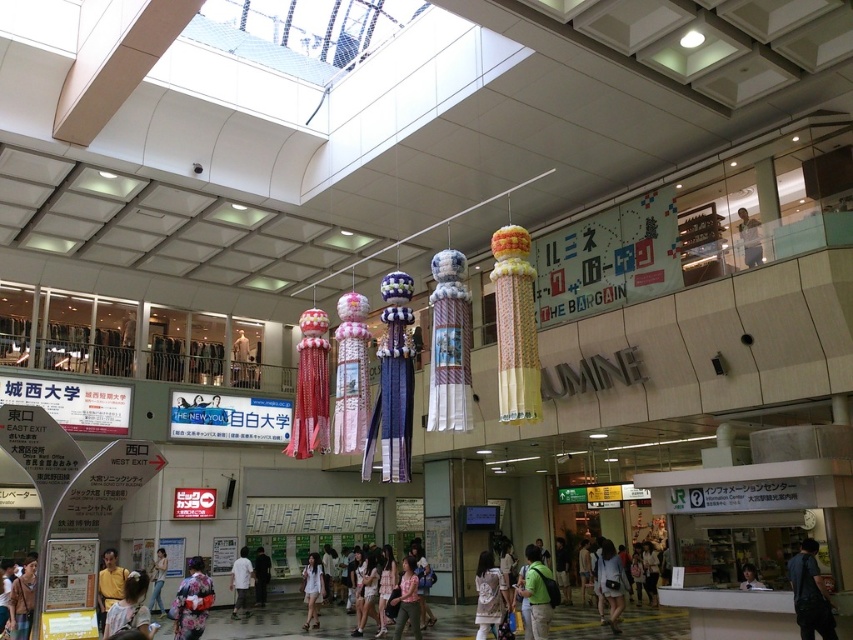
You are a security guard in the mall and need to check both the green backpack at center and the light brown leather jacket at lower left. Which object should you check first if you want to start with the one that is higher up?

The green backpack at center is located above the light brown leather jacket at lower left, so you should check the green backpack at center first.

You are standing in the mall atrium and want to take a photo of the koinobori. You notice two points marked in the image. Which point, point (189, 612) or point (235, 561), is closer to you?

Point (189, 612) is closer to the camera than point (235, 561), so it is the closer point.